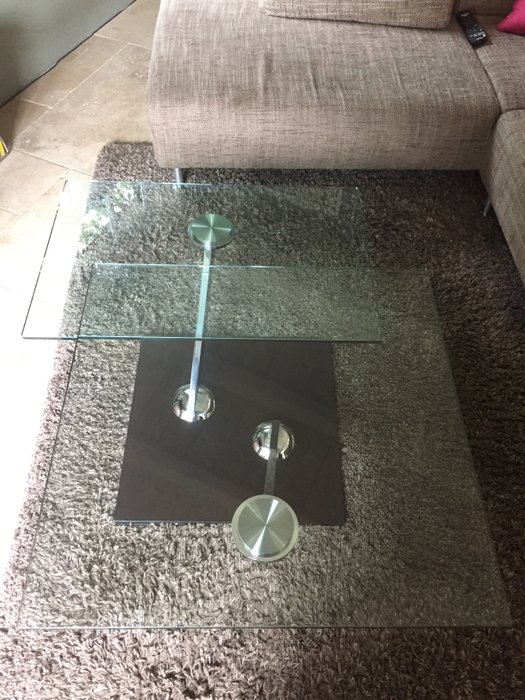
The image size is (525, 700). What are the coordinates of `silver couch legs` in the screenshot? It's located at (178, 175), (485, 204).